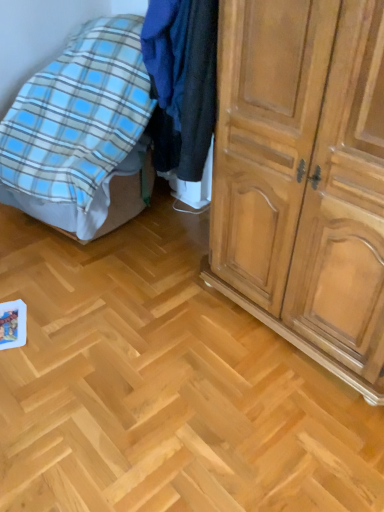
The image size is (384, 512). Describe the element at coordinates (306, 178) in the screenshot. I see `light brown wooden cupboard at right` at that location.

Locate an element on the screen. The height and width of the screenshot is (512, 384). light brown wooden cupboard at right is located at coordinates (306, 178).

I want to click on blue plaid blanket at left, so click(78, 127).

Describe the element at coordinates (78, 127) in the screenshot. I see `blue plaid blanket at left` at that location.

The height and width of the screenshot is (512, 384). What are the coordinates of `light brown wooden cupboard at right` in the screenshot? It's located at [x=306, y=178].

Considering the positions of objects blue plaid blanket at left and light brown wooden cupboard at right in the image provided, who is more to the left, blue plaid blanket at left or light brown wooden cupboard at right?

Positioned to the left is blue plaid blanket at left.

Which is behind, blue plaid blanket at left or light brown wooden cupboard at right?

blue plaid blanket at left is behind.

Which is behind, point (89, 204) or point (261, 14)?

Point (89, 204)

From the image's perspective, is blue plaid blanket at left on light brown wooden cupboard at right?

Yes, from the image's perspective, blue plaid blanket at left is above light brown wooden cupboard at right.

Looking at this image, from a real-world perspective, is blue plaid blanket at left above or below light brown wooden cupboard at right?

blue plaid blanket at left is below light brown wooden cupboard at right.

Looking at their sizes, would you say blue plaid blanket at left is wider or thinner than light brown wooden cupboard at right?

blue plaid blanket at left is wider than light brown wooden cupboard at right.

Is blue plaid blanket at left shorter than light brown wooden cupboard at right?

Correct, blue plaid blanket at left is not as tall as light brown wooden cupboard at right.

Considering the relative sizes of blue plaid blanket at left and light brown wooden cupboard at right in the image provided, is blue plaid blanket at left smaller than light brown wooden cupboard at right?

No.

Is blue plaid blanket at left positioned beyond the bounds of light brown wooden cupboard at right?

Yes, blue plaid blanket at left is not within light brown wooden cupboard at right.

Is blue plaid blanket at left positioned far away from light brown wooden cupboard at right?

Yes.

Is blue plaid blanket at left positioned with its back to light brown wooden cupboard at right?

No, blue plaid blanket at left's orientation is not away from light brown wooden cupboard at right.

How many degrees apart are the facing directions of blue plaid blanket at left and light brown wooden cupboard at right?

The facing directions of blue plaid blanket at left and light brown wooden cupboard at right are 6.63 degrees apart.

Locate an element on the screen. This screenshot has width=384, height=512. bed lying on the left of light brown wooden cupboard at right is located at coordinates (78, 127).

Based on their positions, is light brown wooden cupboard at right located to the left or right of blue plaid blanket at left?

Based on their positions, light brown wooden cupboard at right is located to the right of blue plaid blanket at left.

Is light brown wooden cupboard at right closer to camera compared to blue plaid blanket at left?

Yes.

Considering the positions of point (273, 319) and point (143, 146), is point (273, 319) closer or farther from the camera than point (143, 146)?

Clearly, point (273, 319) is closer to the camera than point (143, 146).

In the scene shown: From the image's perspective, between light brown wooden cupboard at right and blue plaid blanket at left, who is located below?

light brown wooden cupboard at right appears lower in the image.

From a real-world perspective, relative to blue plaid blanket at left, is light brown wooden cupboard at right vertically above or below?

From a real-world perspective, light brown wooden cupboard at right is physically above blue plaid blanket at left.

Between light brown wooden cupboard at right and blue plaid blanket at left, which one has smaller width?

light brown wooden cupboard at right is thinner.

Consider the image. Considering the relative sizes of light brown wooden cupboard at right and blue plaid blanket at left in the image provided, is light brown wooden cupboard at right shorter than blue plaid blanket at left?

In fact, light brown wooden cupboard at right may be taller than blue plaid blanket at left.

Does light brown wooden cupboard at right have a larger size compared to blue plaid blanket at left?

Incorrect, light brown wooden cupboard at right is not larger than blue plaid blanket at left.

Is light brown wooden cupboard at right not inside blue plaid blanket at left?

light brown wooden cupboard at right lies outside blue plaid blanket at left's area.

Is light brown wooden cupboard at right next to blue plaid blanket at left and touching it?

There is a gap between light brown wooden cupboard at right and blue plaid blanket at left.

Could you tell me if light brown wooden cupboard at right is turned towards blue plaid blanket at left?

No, light brown wooden cupboard at right is not oriented towards blue plaid blanket at left.

How many degrees apart are the facing directions of light brown wooden cupboard at right and blue plaid blanket at left?

There is a 6.63-degree angle between the facing directions of light brown wooden cupboard at right and blue plaid blanket at left.

How far apart are light brown wooden cupboard at right and blue plaid blanket at left?

light brown wooden cupboard at right is 3.31 feet away from blue plaid blanket at left.

This screenshot has width=384, height=512. In order to click on bed that appears on the left of light brown wooden cupboard at right in this screenshot , I will do `click(78, 127)`.

Find the location of a particular element. bed that is under the light brown wooden cupboard at right (from a real-world perspective) is located at coordinates (78, 127).

What are the coordinates of `cupboard above the blue plaid blanket at left (from a real-world perspective)` in the screenshot? It's located at (306, 178).